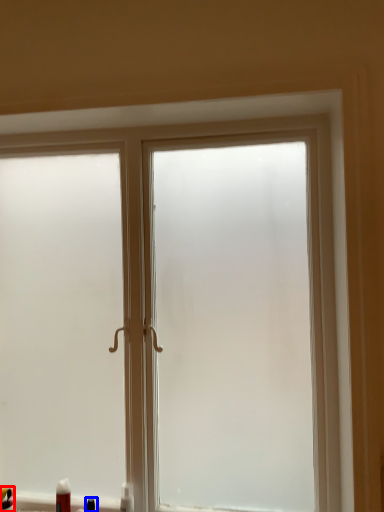
Question: Which object appears farthest to the camera in this image, toiletry (highlighted by a red box) or toiletry (highlighted by a blue box)?

Choices:
 (A) toiletry
 (B) toiletry

Answer: (A)